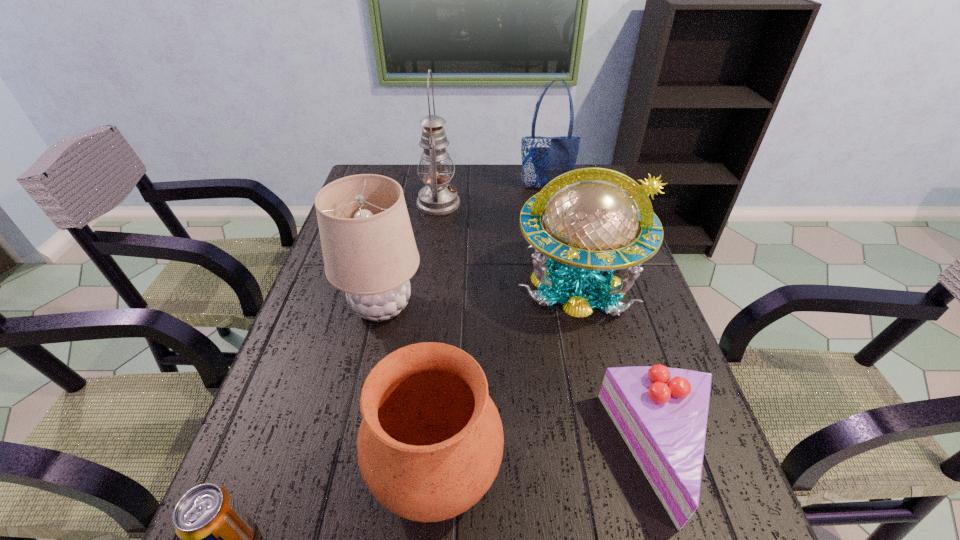
The width and height of the screenshot is (960, 540). What are the coordinates of `oil lamp present at the far edge` in the screenshot? It's located at (438, 198).

This screenshot has width=960, height=540. In order to click on shopping bag positioned at the far edge in this screenshot , I will do 543,158.

Identify the location of object that is at the left edge. (369, 250).

You are a GUI agent. You are given a task and a screenshot of the screen. Output one action in this format:
    pyautogui.click(x=<x>, y=<y>)
    Task: Click on the shopping bag located in the right edge section of the desktop
    This screenshot has height=540, width=960.
    Given the screenshot: What is the action you would take?
    pyautogui.click(x=543, y=158)

At what (x,y) coordinates should I click in order to perform the action: click on globe present at the right edge. Please return your answer as a coordinate pair (x, y). Looking at the image, I should click on (591, 216).

Image resolution: width=960 pixels, height=540 pixels. I want to click on cake positioned at the right edge, so click(x=661, y=412).

Identify the location of object at the far right corner. (543, 158).

The height and width of the screenshot is (540, 960). What are the coordinates of `vacant space at the far edge of the desktop` in the screenshot? It's located at (492, 168).

The image size is (960, 540). I want to click on vacant space at the left edge, so click(x=360, y=319).

The height and width of the screenshot is (540, 960). In order to click on free space at the right edge in this screenshot , I will do `click(676, 354)`.